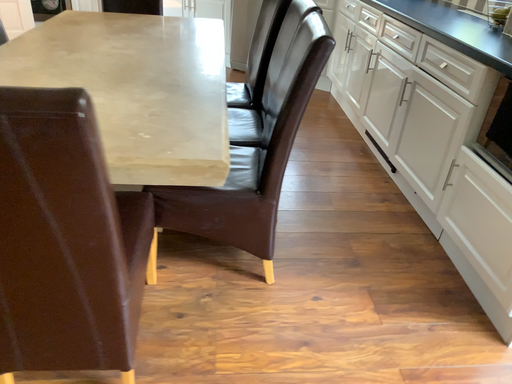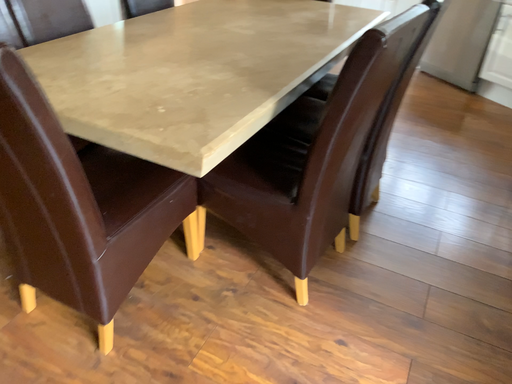
Question: Which way did the camera rotate in the video?

Choices:
 (A) rotated right
 (B) rotated left

Answer: (B)